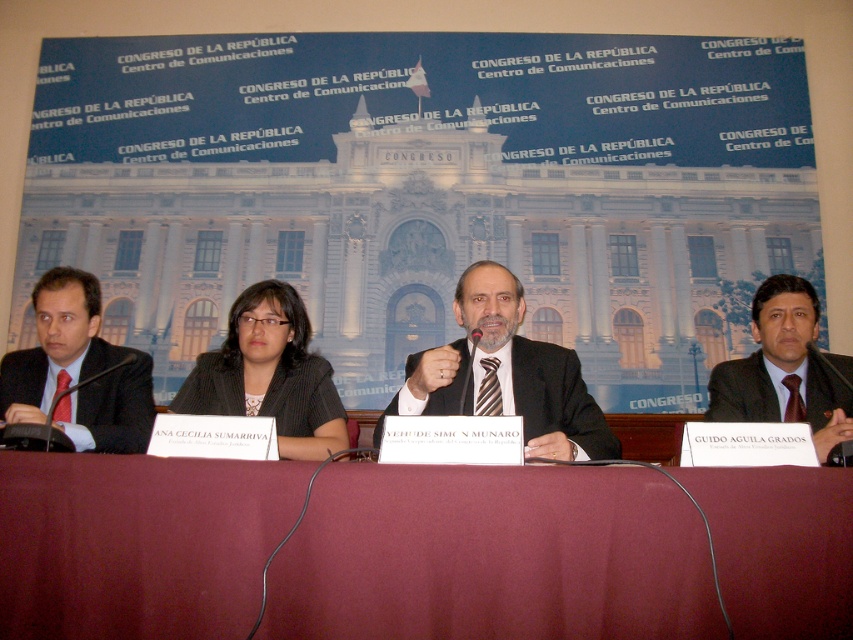
Which is more to the right, dark brown textured suit at center or matte black suit at left?

dark brown textured suit at center

The width and height of the screenshot is (853, 640). In order to click on dark brown textured suit at center in this screenshot , I will do `click(556, 397)`.

Can you confirm if matte black suit at right is smaller than matte black suit at left?

Yes.

Who is more forward, (834, 444) or (85, 404)?

Point (834, 444) is in front.

Between point (807, 282) and point (114, 451), which one is positioned behind?

The point (807, 282) is behind.

At what (x,y) coordinates should I click in order to perform the action: click on matte black suit at right. Please return your answer as a coordinate pair (x, y). Looking at the image, I should click on (782, 369).

Does black textured suit at center have a smaller size compared to dark brown textured suit at center?

No, black textured suit at center is not smaller than dark brown textured suit at center.

Is point (334, 400) closer to camera compared to point (611, 456)?

No, (334, 400) is behind (611, 456).

Find the location of `black textured suit at center`. black textured suit at center is located at coordinates (270, 374).